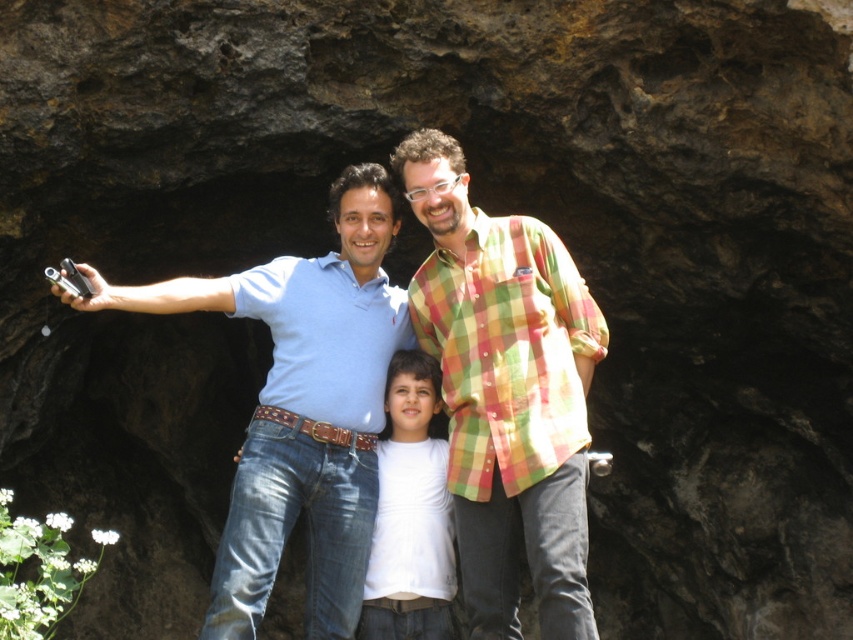
You are trying to decide which person to tag in a photo based on their clothing. You see a matte blue shirt at center and a white matte shirt at center. Which one is taller?

The matte blue shirt at center is much taller than the white matte shirt at center.

You are planning to take a group photo of the matte blue shirt at center and the white matte shirt at center. Which one should be placed closer to the camera to ensure both appear equally sized in the photo?

The white matte shirt at center should be placed closer to the camera because it is smaller in size than the matte blue shirt at center. By positioning the smaller white matte shirt closer, their sizes in the photo will balance out.